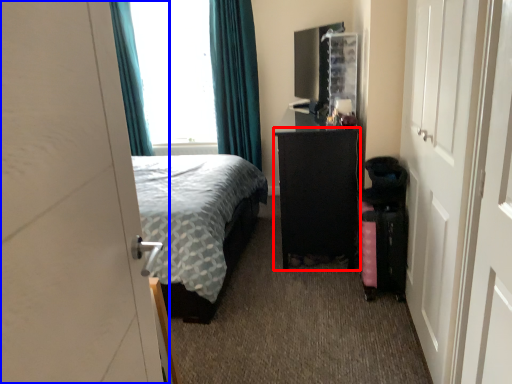
Question: Which point is closer to the camera, furniture (highlighted by a red box) or door (highlighted by a blue box)?

Choices:
 (A) furniture
 (B) door

Answer: (B)